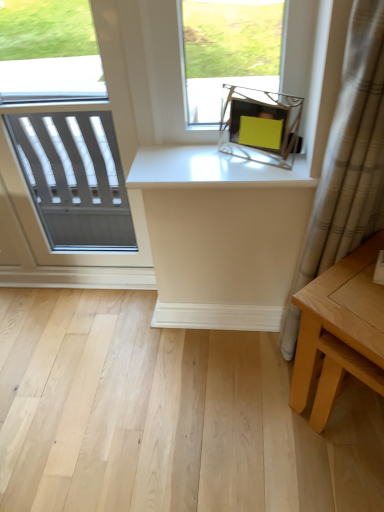
Question: Could you tell me if beige textured curtain at right is turned towards light brown wooden table at lower right?

Choices:
 (A) no
 (B) yes

Answer: (B)

Question: Is beige textured curtain at right positioned behind light brown wooden table at lower right?

Choices:
 (A) no
 (B) yes

Answer: (A)

Question: Is beige textured curtain at right thinner than light brown wooden table at lower right?

Choices:
 (A) yes
 (B) no

Answer: (A)

Question: Is the surface of beige textured curtain at right in direct contact with light brown wooden table at lower right?

Choices:
 (A) no
 (B) yes

Answer: (A)

Question: Is beige textured curtain at right wider than light brown wooden table at lower right?

Choices:
 (A) no
 (B) yes

Answer: (A)

Question: Relative to light brown wooden table at lower right, is white glossy counter top at upper center in front or behind?

Choices:
 (A) front
 (B) behind

Answer: (B)

Question: In the image, is white glossy counter top at upper center on the left side or the right side of light brown wooden table at lower right?

Choices:
 (A) right
 (B) left

Answer: (B)

Question: Considering the positions of white glossy counter top at upper center and light brown wooden table at lower right in the image, is white glossy counter top at upper center wider or thinner than light brown wooden table at lower right?

Choices:
 (A) wide
 (B) thin

Answer: (B)

Question: Would you say white glossy counter top at upper center is inside or outside light brown wooden table at lower right?

Choices:
 (A) outside
 (B) inside

Answer: (A)

Question: Would you say light brown wooden table at lower right is inside or outside white glossy counter top at upper center?

Choices:
 (A) outside
 (B) inside

Answer: (A)

Question: From a real-world perspective, is light brown wooden table at lower right above or below white glossy counter top at upper center?

Choices:
 (A) above
 (B) below

Answer: (B)

Question: In terms of width, does light brown wooden table at lower right look wider or thinner when compared to white glossy counter top at upper center?

Choices:
 (A) thin
 (B) wide

Answer: (B)

Question: From their relative heights in the image, would you say light brown wooden table at lower right is taller or shorter than white glossy counter top at upper center?

Choices:
 (A) tall
 (B) short

Answer: (A)

Question: Is light brown wooden table at lower right inside or outside of beige textured curtain at right?

Choices:
 (A) outside
 (B) inside

Answer: (A)

Question: Is light brown wooden table at lower right taller or shorter than beige textured curtain at right?

Choices:
 (A) short
 (B) tall

Answer: (A)